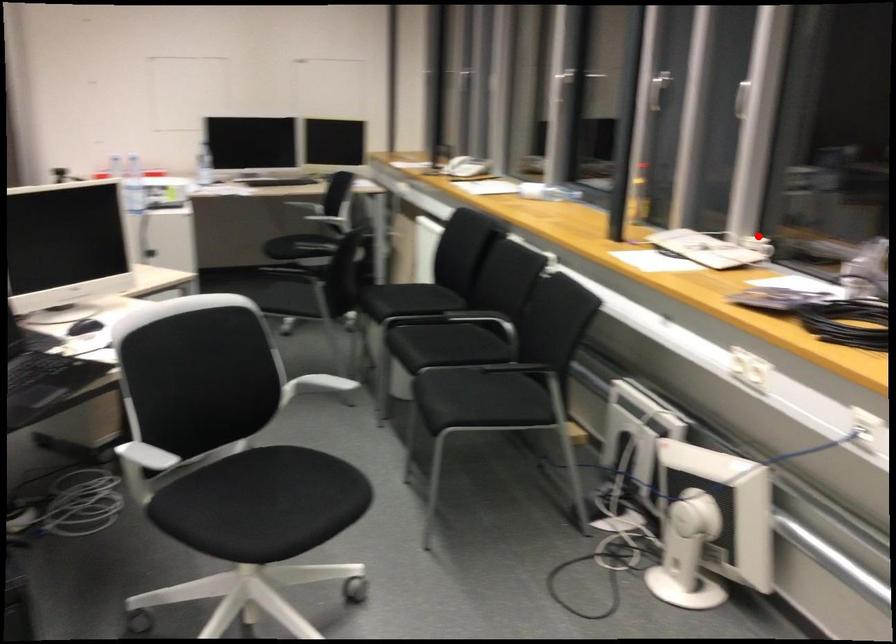
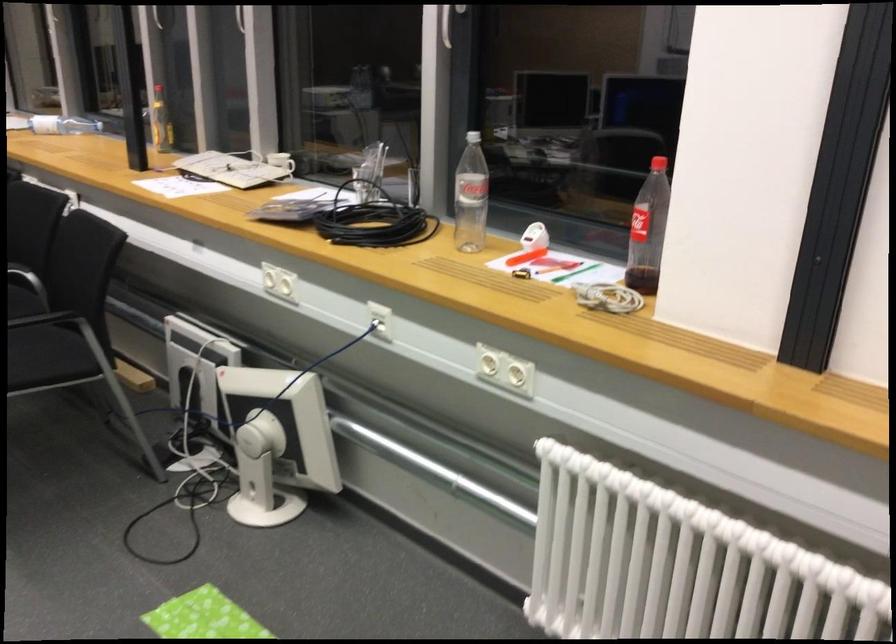
Question: I am providing you with two images of the same scene from different viewpoints. A red point is marked on the first image. Can you still see the location of the red point in image 2?

Choices:
 (A) Yes
 (B) No

Answer: (A)